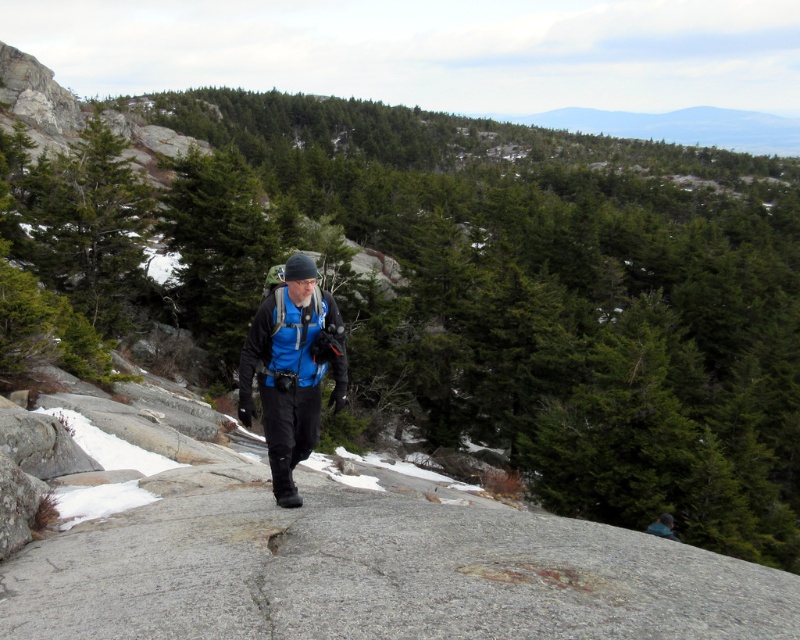
You are a hiker preparing to cross a narrow rocky path. You notice the blue matte jacket at center and the blue fabric backpack at center. Which item is wider?

The blue matte jacket at center is wider than the blue fabric backpack at center according to the description.